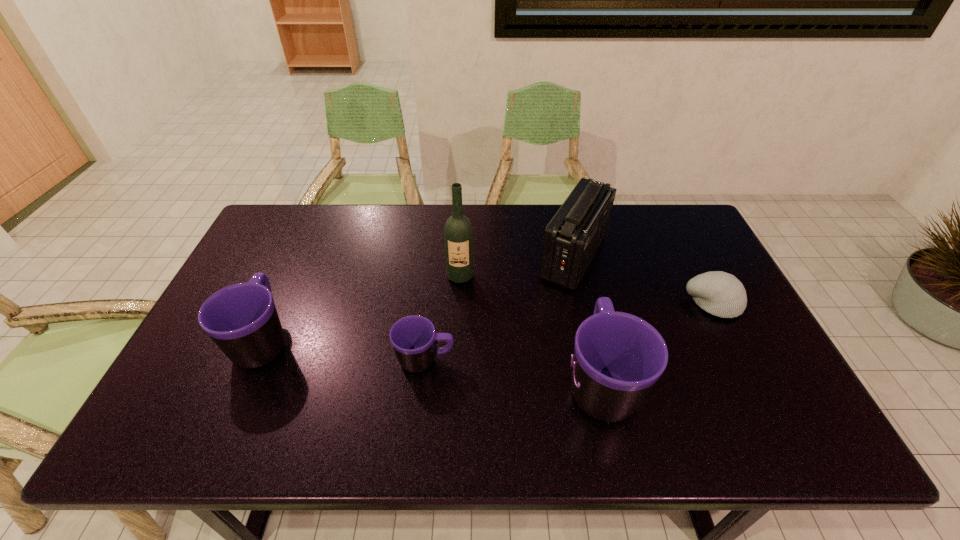
This screenshot has width=960, height=540. Identify the location of vacant point located between the radio receiver and the leftmost mug. [419, 299].

The width and height of the screenshot is (960, 540). Identify the location of blank region between the tallest object and the second mug from left to right. [443, 318].

Locate an element on the screen. This screenshot has height=540, width=960. vacant area that lies between the rightmost mug and the second mug from left to right is located at coordinates (513, 372).

Where is `free space between the shortest mug and the rightmost object`? Image resolution: width=960 pixels, height=540 pixels. free space between the shortest mug and the rightmost object is located at coordinates (569, 332).

Image resolution: width=960 pixels, height=540 pixels. I want to click on free space between the leftmost object and the shortest mug, so click(345, 350).

Identify which object is the third closest to the rightmost mug. Please provide its 2D coordinates. Your answer should be formatted as a tuple, i.e. [(x, y)], where the tuple contains the x and y coordinates of a point satisfying the conditions above.

[(414, 339)]

You are a GUI agent. You are given a task and a screenshot of the screen. Output one action in this format:
    pyautogui.click(x=<x>, y=<y>)
    Task: Click on the object that is the second closest to the radio receiver
    
    Given the screenshot: What is the action you would take?
    (x=618, y=357)

Locate which mug is the second closest to the shortest mug. Please provide its 2D coordinates. Your answer should be formatted as a tuple, i.e. [(x, y)], where the tuple contains the x and y coordinates of a point satisfying the conditions above.

[(242, 320)]

Locate an element on the screen. mug that is the second closest to the beanie is located at coordinates (414, 339).

The height and width of the screenshot is (540, 960). Find the location of `vacant space that satisfies the following two spatial constraints: 1. on the front panel of the radio receiver; 2. on the labeled side of the wine bottle`. vacant space that satisfies the following two spatial constraints: 1. on the front panel of the radio receiver; 2. on the labeled side of the wine bottle is located at coordinates (578, 276).